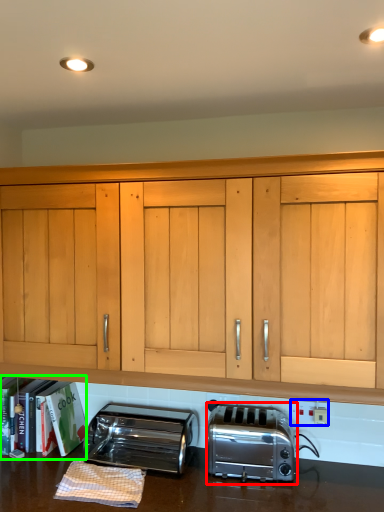
Question: Considering the real-world distances, which object is farthest from toaster (highlighted by a red box)? electric outlet (highlighted by a blue box) or bookshelf (highlighted by a green box)?

Choices:
 (A) electric outlet
 (B) bookshelf

Answer: (B)